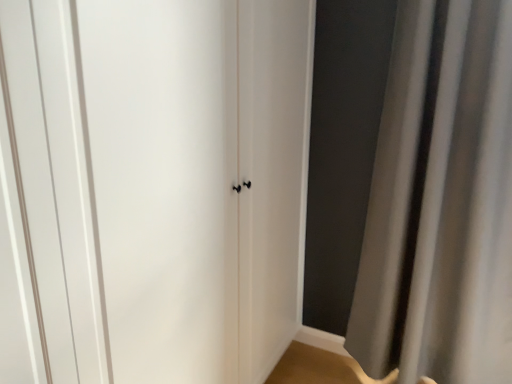
Question: Would you say white matte door at center is to the left or to the right of gray fabric curtain at right in the picture?

Choices:
 (A) right
 (B) left

Answer: (B)

Question: From the image's perspective, relative to gray fabric curtain at right, is white matte door at center above or below?

Choices:
 (A) below
 (B) above

Answer: (A)

Question: Based on their sizes in the image, would you say white matte door at center is bigger or smaller than gray fabric curtain at right?

Choices:
 (A) big
 (B) small

Answer: (B)

Question: Relative to white matte door at center, is gray fabric curtain at right in front or behind?

Choices:
 (A) behind
 (B) front

Answer: (A)

Question: Would you say gray fabric curtain at right is inside or outside white matte door at center?

Choices:
 (A) inside
 (B) outside

Answer: (B)

Question: Does point (415, 370) appear closer or farther from the camera than point (224, 349)?

Choices:
 (A) closer
 (B) farther

Answer: (B)

Question: From a real-world perspective, is gray fabric curtain at right above or below white matte door at center?

Choices:
 (A) below
 (B) above

Answer: (A)